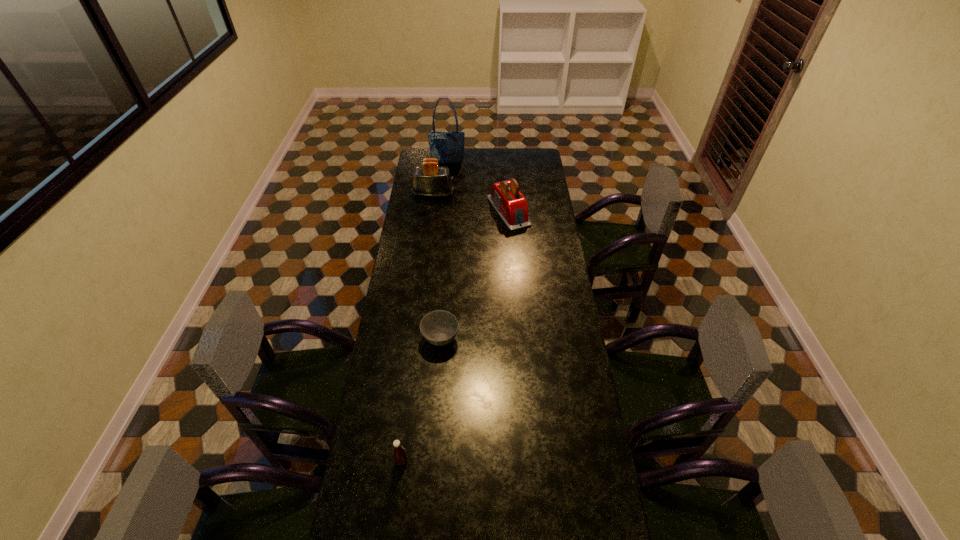
Where is `free space between the shortest object and the left toaster`? The width and height of the screenshot is (960, 540). free space between the shortest object and the left toaster is located at coordinates (437, 266).

At what (x,y) coordinates should I click in order to perform the action: click on vacant region between the nearest object and the tallest object. Please return your answer as a coordinate pair (x, y). Image resolution: width=960 pixels, height=540 pixels. Looking at the image, I should click on (424, 312).

This screenshot has width=960, height=540. Identify the location of object that is the closest to the bowl. (399, 452).

Where is `the second closest object to the left toaster`? the second closest object to the left toaster is located at coordinates (447, 147).

Find the location of a particular element. This screenshot has width=960, height=540. vacant space that satisfies the following two spatial constraints: 1. on the side of the left toaster with the control lever; 2. on the back side of the right toaster is located at coordinates (431, 211).

Where is `blank area in the image that satisfies the following two spatial constraints: 1. on the back side of the bowl; 2. on the left side of the right toaster`? This screenshot has height=540, width=960. blank area in the image that satisfies the following two spatial constraints: 1. on the back side of the bowl; 2. on the left side of the right toaster is located at coordinates (450, 211).

Where is `free point that satisfies the following two spatial constraints: 1. on the back side of the right toaster; 2. on the side of the left toaster with the control lever`? The height and width of the screenshot is (540, 960). free point that satisfies the following two spatial constraints: 1. on the back side of the right toaster; 2. on the side of the left toaster with the control lever is located at coordinates (508, 194).

Locate an element on the screen. The image size is (960, 540). vacant space that satisfies the following two spatial constraints: 1. on the side of the left toaster with the control lever; 2. on the right side of the rightmost object is located at coordinates (431, 211).

You are a GUI agent. You are given a task and a screenshot of the screen. Output one action in this format:
    pyautogui.click(x=<x>, y=<y>)
    Task: Click on the free space that satisfies the following two spatial constraints: 1. on the side of the left toaster with the control lever; 2. on the back side of the second nearest object
    This screenshot has width=960, height=540.
    Given the screenshot: What is the action you would take?
    pyautogui.click(x=416, y=339)

Where is `free location that satisfies the following two spatial constraints: 1. on the front-facing side of the tallest object; 2. on the side of the left toaster with the control lever`? The image size is (960, 540). free location that satisfies the following two spatial constraints: 1. on the front-facing side of the tallest object; 2. on the side of the left toaster with the control lever is located at coordinates (444, 194).